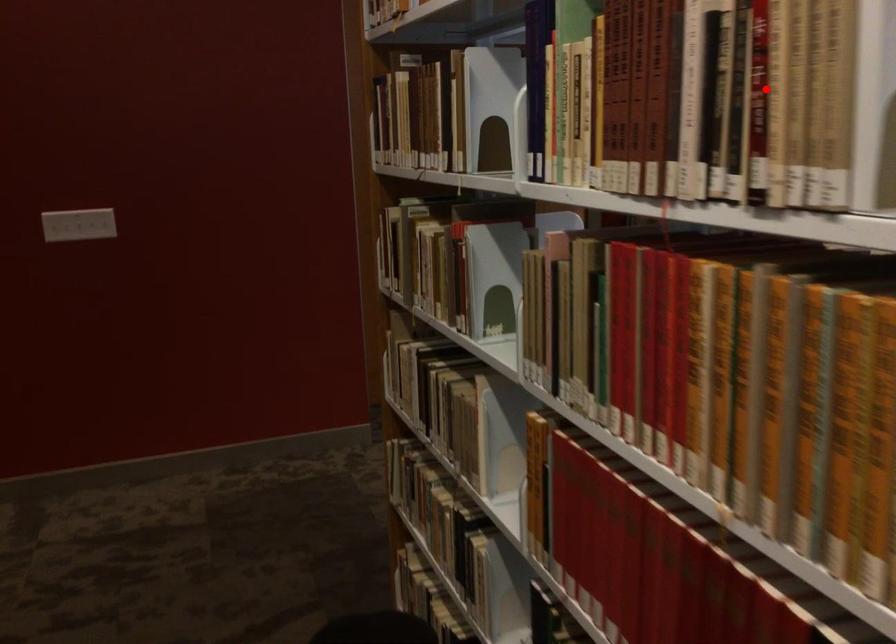
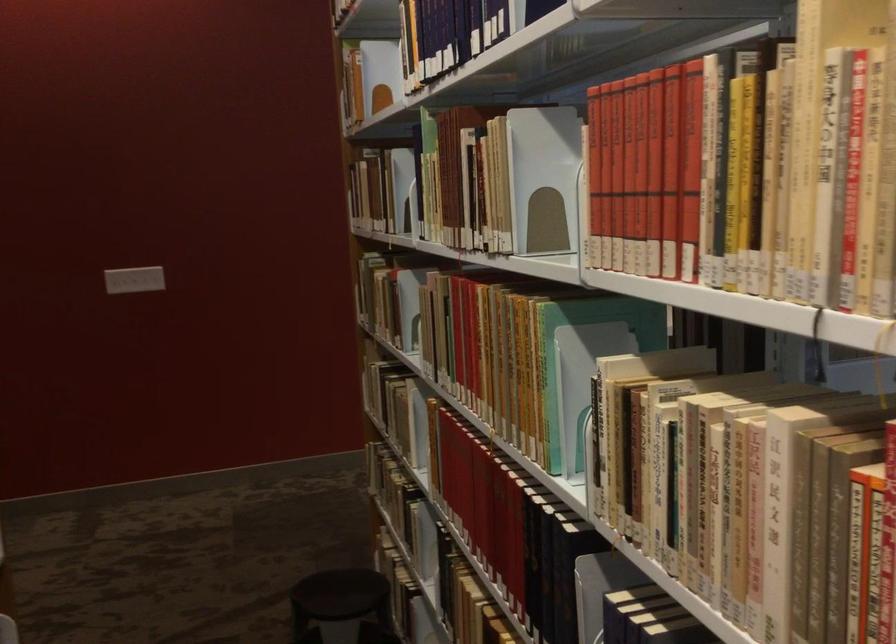
Question: I am providing you with two images of the same scene from different viewpoints. A red point is marked on the first image. Can you still see the location of the red point in image 2?

Choices:
 (A) Yes
 (B) No

Answer: (A)